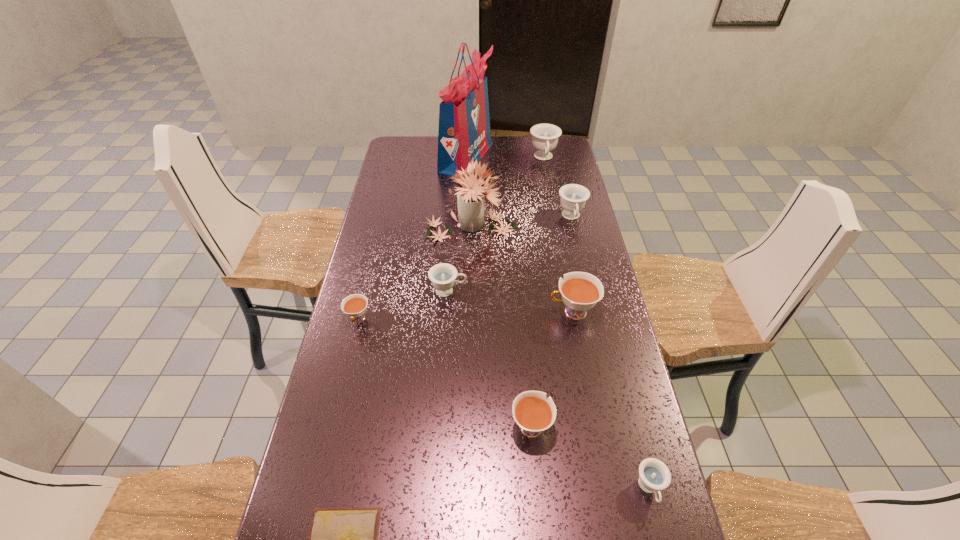
Identify the location of vacant area that lies between the leftmost teacup and the second farthest blue teacup. (465, 268).

This screenshot has height=540, width=960. What are the coordinates of `empty location between the leftmost teacup and the grocery bag` in the screenshot? It's located at (412, 238).

Where is `unoccupied position between the biggest blue teacup and the tallest object`? Image resolution: width=960 pixels, height=540 pixels. unoccupied position between the biggest blue teacup and the tallest object is located at coordinates (505, 158).

Identify which object is the fifth nearest to the second tallest object. Please provide its 2D coordinates. Your answer should be formatted as a tuple, i.e. [(x, y)], where the tuple contains the x and y coordinates of a point satisfying the conditions above.

[(544, 136)]

Image resolution: width=960 pixels, height=540 pixels. I want to click on the third closest object to the grocery bag, so click(573, 196).

Image resolution: width=960 pixels, height=540 pixels. Identify the location of teacup that is the third nearest to the leftmost teacup. (580, 291).

Locate which teacup ranks sixth in proximity to the nearest teacup. Please provide its 2D coordinates. Your answer should be formatted as a tuple, i.e. [(x, y)], where the tuple contains the x and y coordinates of a point satisfying the conditions above.

[(544, 136)]

Locate an element on the screen. blue teacup that is the closest to the white bouquet is located at coordinates (573, 196).

Select which blue teacup is the fourth closest to the rightmost white teacup. Please provide its 2D coordinates. Your answer should be formatted as a tuple, i.e. [(x, y)], where the tuple contains the x and y coordinates of a point satisfying the conditions above.

[(544, 136)]

Select which white teacup is the closest to the fifth teacup from right to left. Please provide its 2D coordinates. Your answer should be formatted as a tuple, i.e. [(x, y)], where the tuple contains the x and y coordinates of a point satisfying the conditions above.

[(580, 291)]